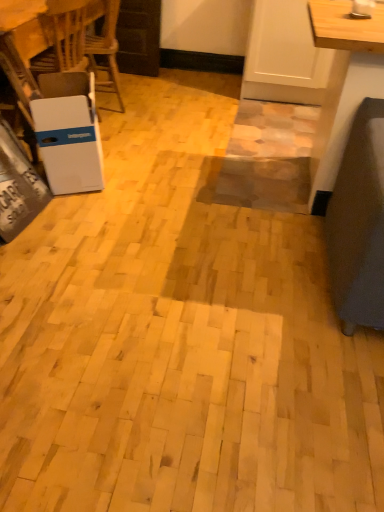
Question: In the image, is white cardboard box at left positioned in front of or behind white plastic table at left?

Choices:
 (A) behind
 (B) front

Answer: (B)

Question: Considering the positions of point (52, 150) and point (13, 37), is point (52, 150) closer or farther from the camera than point (13, 37)?

Choices:
 (A) closer
 (B) farther

Answer: (A)

Question: Would you say white cardboard box at left is inside or outside white plastic table at left?

Choices:
 (A) inside
 (B) outside

Answer: (B)

Question: Considering the positions of white plastic table at left and white cardboard box at left in the image, is white plastic table at left wider or thinner than white cardboard box at left?

Choices:
 (A) thin
 (B) wide

Answer: (B)

Question: From their relative heights in the image, would you say white plastic table at left is taller or shorter than white cardboard box at left?

Choices:
 (A) tall
 (B) short

Answer: (A)

Question: Which is correct: white plastic table at left is inside white cardboard box at left, or outside of it?

Choices:
 (A) outside
 (B) inside

Answer: (A)

Question: Considering their positions, is white plastic table at left located in front of or behind white cardboard box at left?

Choices:
 (A) behind
 (B) front

Answer: (A)